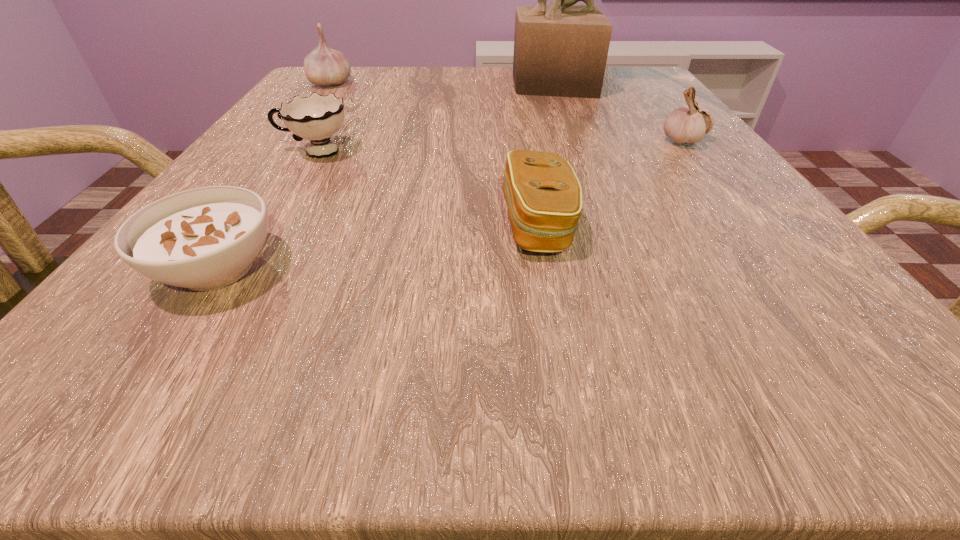
The height and width of the screenshot is (540, 960). Find the location of `vacant area situated 0.110m on the front-facing side of the tallest object`. vacant area situated 0.110m on the front-facing side of the tallest object is located at coordinates (459, 84).

Identify the location of free point located 0.320m on the right of the taller garlic. (501, 83).

At what (x,y) coordinates should I click in order to perform the action: click on vacant space located 0.120m on the front of the right garlic. Please return your answer as a coordinate pair (x, y). Image resolution: width=960 pixels, height=540 pixels. Looking at the image, I should click on (723, 191).

Locate an element on the screen. This screenshot has width=960, height=540. vacant space located 0.390m on the zipper side of the clutch bag is located at coordinates (197, 224).

Find the location of `vacant space positioned on the zipper side of the clutch bag`. vacant space positioned on the zipper side of the clutch bag is located at coordinates (409, 224).

Locate an element on the screen. This screenshot has height=540, width=960. vacant region located 0.180m on the zipper side of the clutch bag is located at coordinates (362, 224).

Image resolution: width=960 pixels, height=540 pixels. What are the coordinates of `free location located on the back of the soup bowl` in the screenshot? It's located at (289, 163).

Find the location of a particular element. sculpture that is at the far edge is located at coordinates (561, 50).

Locate an element on the screen. garlic that is at the far edge is located at coordinates coord(324,66).

This screenshot has width=960, height=540. I want to click on garlic present at the left edge, so click(324, 66).